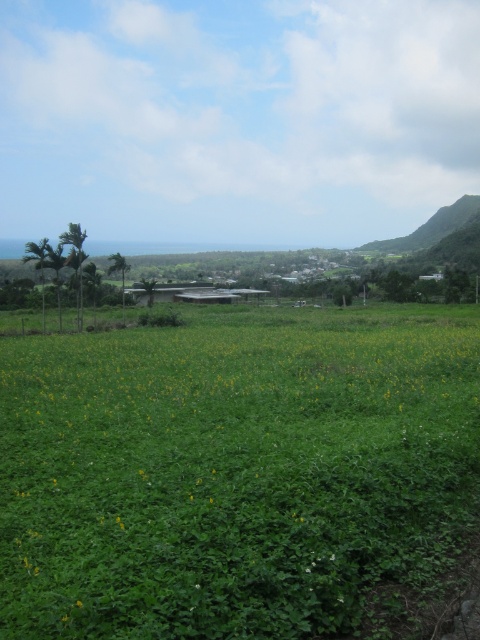
Is green grassy field at center positioned at the back of yellow matte flower at center?

That is False.

In the scene shown: Measure the distance between green grassy field at center and camera.

green grassy field at center is 3.84 meters away from camera.

Where is `green grassy field at center`? This screenshot has width=480, height=640. green grassy field at center is located at coordinates (236, 472).